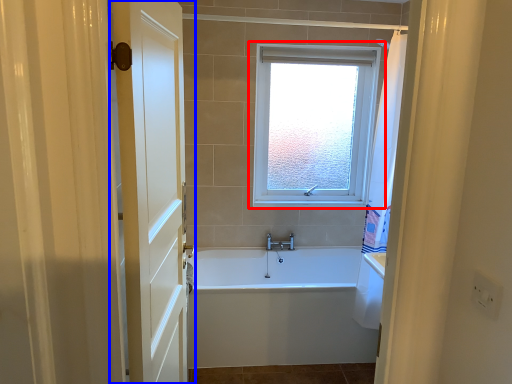
Question: Which object appears closest to the camera in this image, window (highlighted by a red box) or door (highlighted by a blue box)?

Choices:
 (A) window
 (B) door

Answer: (B)